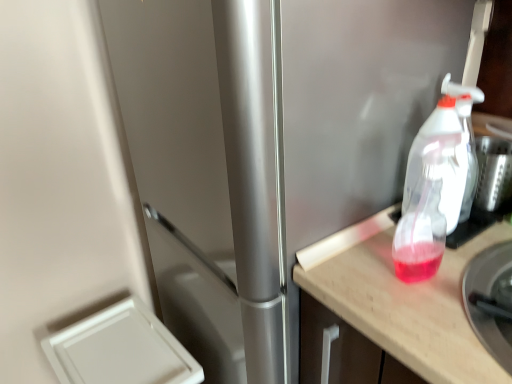
Question: Is white plastic drawer at lower left, which is counted as the second appliance, starting from the right, oriented towards translucent plastic spray bottle at right?

Choices:
 (A) yes
 (B) no

Answer: (B)

Question: From a real-world perspective, does white plastic drawer at lower left, acting as the first appliance starting from the back, stand above translucent plastic spray bottle at right?

Choices:
 (A) yes
 (B) no

Answer: (B)

Question: Does white plastic drawer at lower left, arranged as the 1th appliance when viewed from the left, have a greater width compared to translucent plastic spray bottle at right?

Choices:
 (A) no
 (B) yes

Answer: (B)

Question: Is white plastic drawer at lower left, arranged as the 1th appliance when viewed from the left, outside translucent plastic spray bottle at right?

Choices:
 (A) yes
 (B) no

Answer: (A)

Question: From the image's perspective, does white plastic drawer at lower left, the 2th appliance from the top, appear lower than translucent plastic spray bottle at right?

Choices:
 (A) yes
 (B) no

Answer: (A)

Question: From the image's perspective, would you say white plastic drawer at lower left, acting as the first appliance starting from the back, is positioned over translucent plastic spray bottle at right?

Choices:
 (A) yes
 (B) no

Answer: (B)

Question: Considering the relative sizes of metallic silver bowl at right, which ranks as the first appliance in top-to-bottom order, and translucent plastic spray bottle at right in the image provided, is metallic silver bowl at right, which ranks as the first appliance in top-to-bottom order, bigger than translucent plastic spray bottle at right?

Choices:
 (A) no
 (B) yes

Answer: (B)

Question: From a real-world perspective, is metallic silver bowl at right, the 2th appliance when ordered from back to front, physically above translucent plastic spray bottle at right?

Choices:
 (A) yes
 (B) no

Answer: (B)

Question: Would you say metallic silver bowl at right, which appears as the first appliance when viewed from the right, is outside translucent plastic spray bottle at right?

Choices:
 (A) no
 (B) yes

Answer: (B)

Question: Considering the relative positions of metallic silver bowl at right, which ranks as the first appliance in top-to-bottom order, and translucent plastic spray bottle at right in the image provided, is metallic silver bowl at right, which ranks as the first appliance in top-to-bottom order, to the right of translucent plastic spray bottle at right from the viewer's perspective?

Choices:
 (A) no
 (B) yes

Answer: (B)

Question: Does metallic silver bowl at right, which appears as the first appliance when viewed from the right, have a greater height compared to translucent plastic spray bottle at right?

Choices:
 (A) yes
 (B) no

Answer: (B)

Question: Can you confirm if metallic silver bowl at right, which is counted as the 2th appliance, starting from the bottom, is wider than translucent plastic spray bottle at right?

Choices:
 (A) yes
 (B) no

Answer: (A)

Question: Is wooden countertop at right at the back of metallic silver bowl at right, the 2th appliance when ordered from back to front?

Choices:
 (A) no
 (B) yes

Answer: (B)